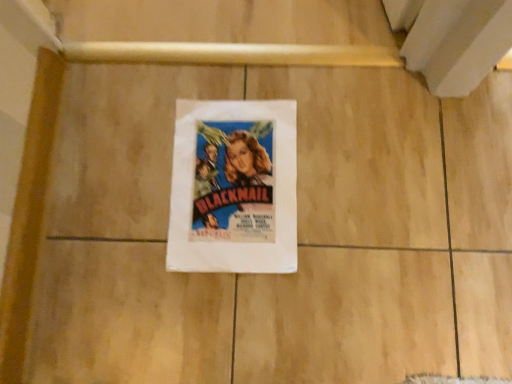
Question: Should I look upward or downward to see vintage paper poster at center?

Choices:
 (A) up
 (B) down

Answer: (A)